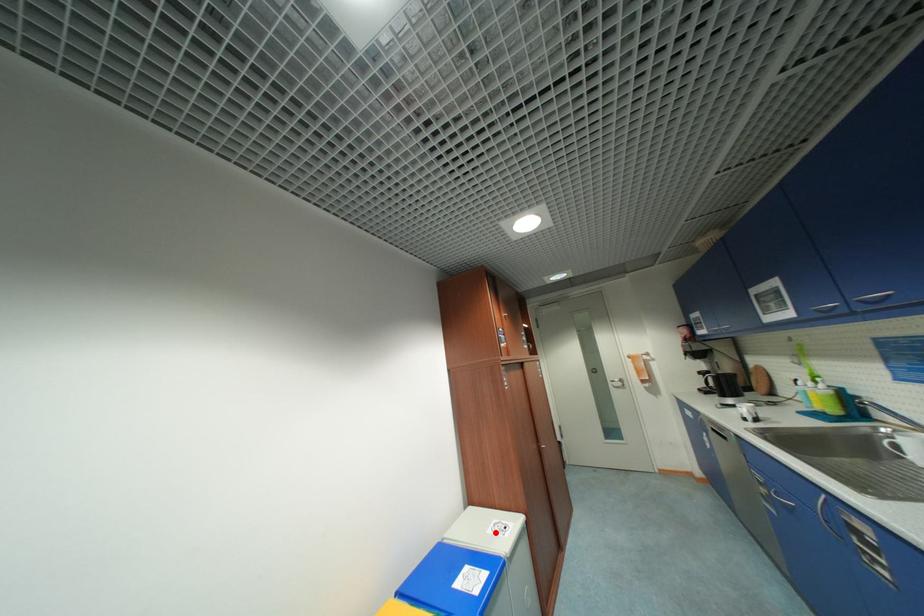
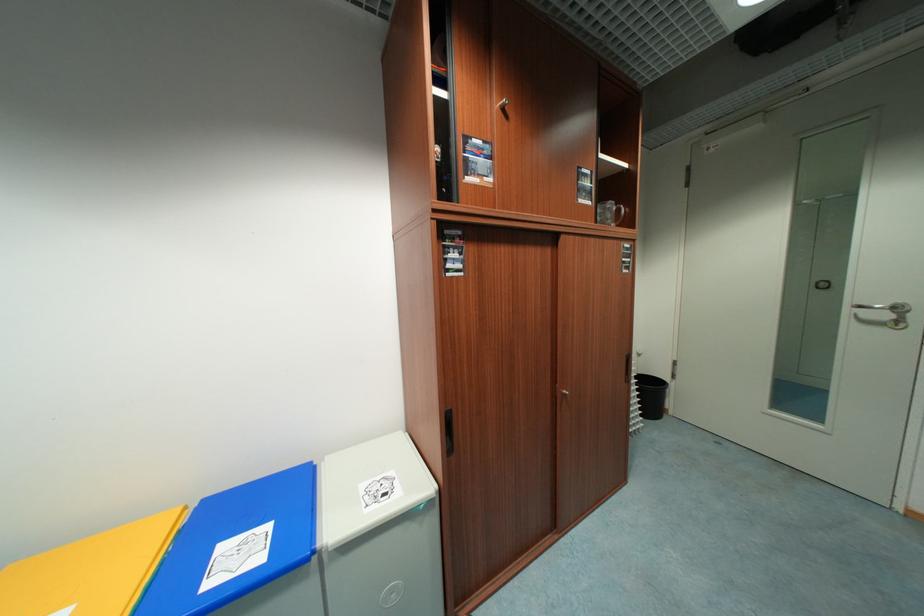
Question: I am providing you with two images of the same scene from different viewpoints. A red point is marked on the first image. Is the red point's position out of view in image 2?

Choices:
 (A) Yes
 (B) No

Answer: (B)